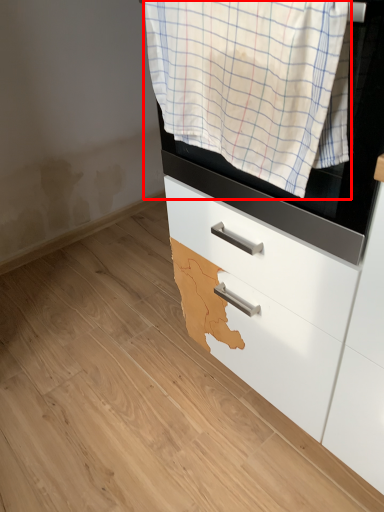
Question: From the image, what is the correct spatial relationship of clothing (annotated by the red box) in relation to chest of drawers?

Choices:
 (A) left
 (B) right

Answer: (A)